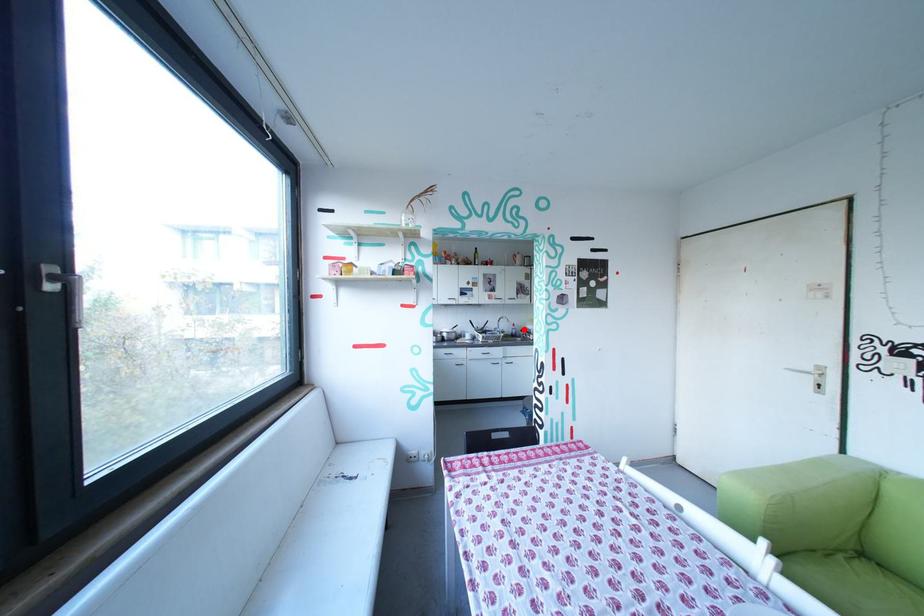
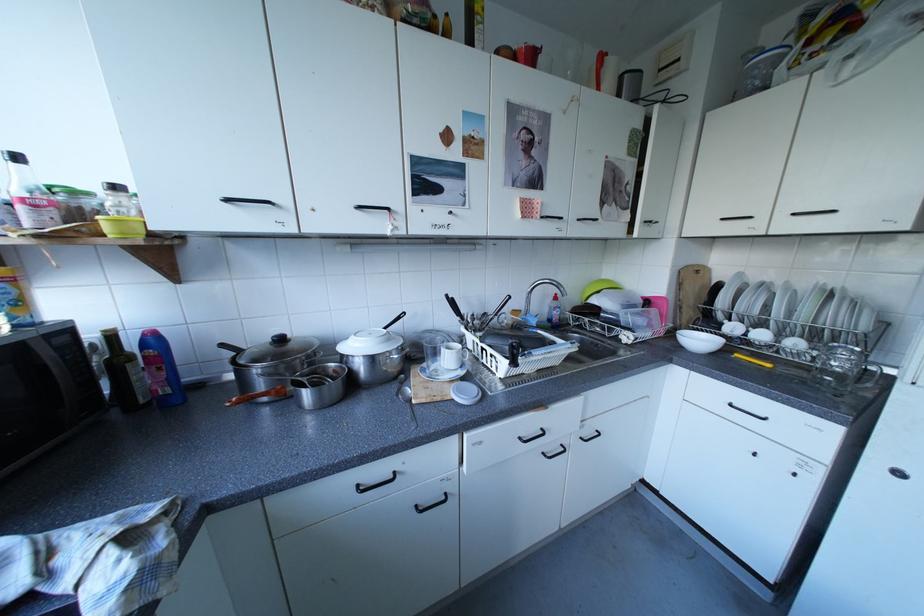
Locate, in the second image, the point that corresponds to the highlighted location in the first image.

(558, 310)